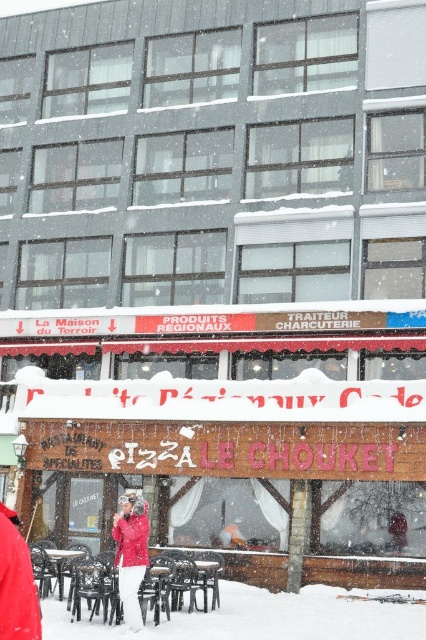
Question: Is white powdery snow at lower center behind matte red jacket at center?

Choices:
 (A) no
 (B) yes

Answer: (A)

Question: Is white powdery snow at lower center below matte red jacket at center?

Choices:
 (A) no
 (B) yes

Answer: (B)

Question: Which point appears farthest from the camera in this image?

Choices:
 (A) (120, 544)
 (B) (331, 596)

Answer: (B)

Question: Which is nearer to the matte red jacket at center?

Choices:
 (A) red matte jacket at center
 (B) white powdery snow at lower center

Answer: (A)

Question: Is white powdery snow at lower center thinner than matte red jacket at center?

Choices:
 (A) no
 (B) yes

Answer: (A)

Question: Among these objects, which one is nearest to the camera?

Choices:
 (A) white powdery snow at lower center
 (B) red matte jacket at center
 (C) matte red jacket at center

Answer: (A)